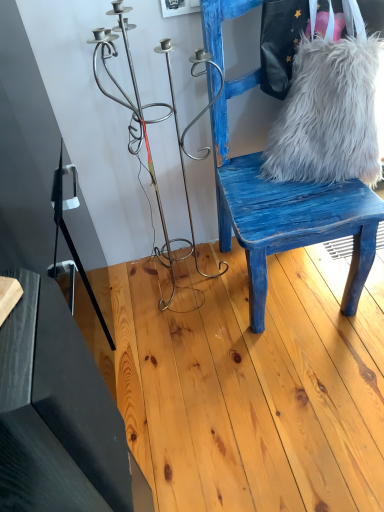
Question: Is blue distressed wood chair at right further to camera compared to white fluffy bag at right?

Choices:
 (A) no
 (B) yes

Answer: (A)

Question: From the image's perspective, is blue distressed wood chair at right above white fluffy bag at right?

Choices:
 (A) yes
 (B) no

Answer: (B)

Question: Considering the relative sizes of blue distressed wood chair at right and white fluffy bag at right in the image provided, is blue distressed wood chair at right shorter than white fluffy bag at right?

Choices:
 (A) no
 (B) yes

Answer: (A)

Question: Is blue distressed wood chair at right positioned far away from white fluffy bag at right?

Choices:
 (A) yes
 (B) no

Answer: (B)

Question: Is blue distressed wood chair at right bigger than white fluffy bag at right?

Choices:
 (A) no
 (B) yes

Answer: (B)

Question: Is blue distressed wood chair at right at the left side of white fluffy bag at right?

Choices:
 (A) no
 (B) yes

Answer: (B)

Question: Does white fluffy fur at right have a greater height compared to white fluffy bag at right?

Choices:
 (A) yes
 (B) no

Answer: (A)

Question: Is white fluffy fur at right bigger than white fluffy bag at right?

Choices:
 (A) no
 (B) yes

Answer: (B)

Question: Considering the relative sizes of white fluffy fur at right and white fluffy bag at right in the image provided, is white fluffy fur at right smaller than white fluffy bag at right?

Choices:
 (A) no
 (B) yes

Answer: (A)

Question: Would you say white fluffy fur at right is a long distance from white fluffy bag at right?

Choices:
 (A) no
 (B) yes

Answer: (A)

Question: Can we say white fluffy fur at right lies outside white fluffy bag at right?

Choices:
 (A) no
 (B) yes

Answer: (A)

Question: Does white fluffy fur at right contain white fluffy bag at right?

Choices:
 (A) no
 (B) yes

Answer: (B)

Question: Is white fluffy bag at right to the left of blue distressed wood chair at right from the viewer's perspective?

Choices:
 (A) yes
 (B) no

Answer: (B)